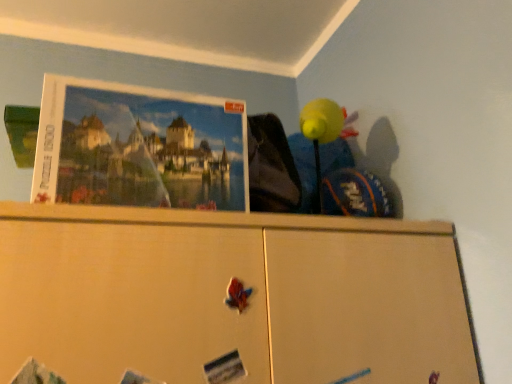
What are the coordinates of `matte cardboard puzzle box at upper left` in the screenshot? It's located at (139, 147).

The height and width of the screenshot is (384, 512). What do you see at coordinates (139, 147) in the screenshot? I see `matte cardboard puzzle box at upper left` at bounding box center [139, 147].

Image resolution: width=512 pixels, height=384 pixels. Find the location of `matte cardboard puzzle box at upper left`. matte cardboard puzzle box at upper left is located at coordinates (x=139, y=147).